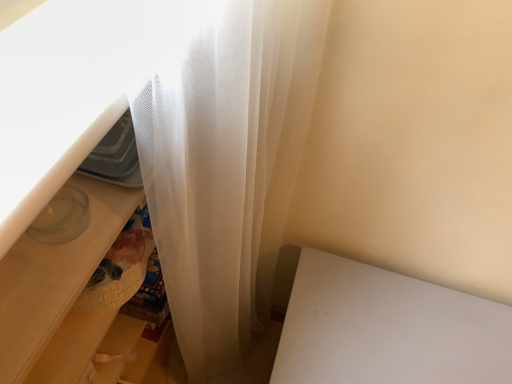
Question: Considering the positions of white matte table at lower right and translucent plastic drawer at lower left in the image, is white matte table at lower right wider or thinner than translucent plastic drawer at lower left?

Choices:
 (A) thin
 (B) wide

Answer: (B)

Question: From a real-world perspective, is white matte table at lower right above or below translucent plastic drawer at lower left?

Choices:
 (A) below
 (B) above

Answer: (A)

Question: Is point (314, 261) positioned closer to the camera than point (83, 273)?

Choices:
 (A) closer
 (B) farther

Answer: (B)

Question: Is translucent plastic drawer at lower left wider or thinner than white matte table at lower right?

Choices:
 (A) thin
 (B) wide

Answer: (A)

Question: From the image's perspective, is translucent plastic drawer at lower left located above or below white matte table at lower right?

Choices:
 (A) above
 (B) below

Answer: (A)

Question: Looking at the image, does translucent plastic drawer at lower left seem bigger or smaller compared to white matte table at lower right?

Choices:
 (A) big
 (B) small

Answer: (B)

Question: Relative to white matte table at lower right, is translucent plastic drawer at lower left in front or behind?

Choices:
 (A) behind
 (B) front

Answer: (B)